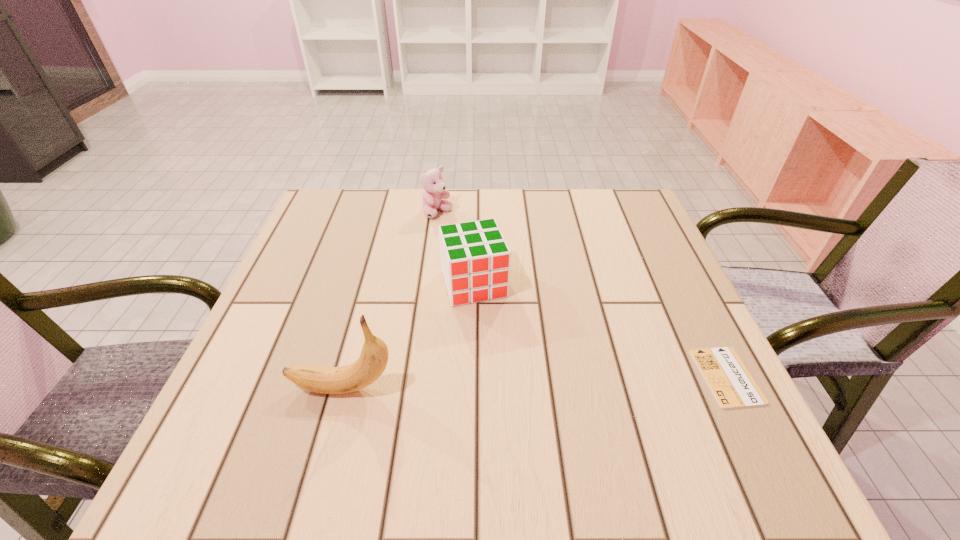
I want to click on empty space between the tallest object and the teddy bear, so click(390, 301).

At what (x,y) coordinates should I click in order to perform the action: click on vacant space in between the rightmost object and the banana. Please return your answer as a coordinate pair (x, y). This screenshot has width=960, height=540. Looking at the image, I should click on (535, 382).

This screenshot has height=540, width=960. In order to click on free area in between the tallest object and the shortest object in this screenshot , I will do tap(535, 382).

Locate an element on the screen. free space between the third nearest object and the banana is located at coordinates (x=408, y=336).

At what (x,y) coordinates should I click in order to perform the action: click on unoccupied area between the teddy bear and the rightmost object. Please return your answer as a coordinate pair (x, y). Image resolution: width=960 pixels, height=540 pixels. Looking at the image, I should click on (583, 295).

Where is `vacant space in between the identity card and the farthest object`? The height and width of the screenshot is (540, 960). vacant space in between the identity card and the farthest object is located at coordinates (583, 295).

Locate an element on the screen. The height and width of the screenshot is (540, 960). object identified as the closest to the teddy bear is located at coordinates (475, 259).

The height and width of the screenshot is (540, 960). In order to click on object that can be found as the second closest to the banana in this screenshot , I will do [x=434, y=191].

Identify the location of vacant space that satisfies the following two spatial constraints: 1. on the front side of the identity card; 2. on the left side of the farthest object. (418, 376).